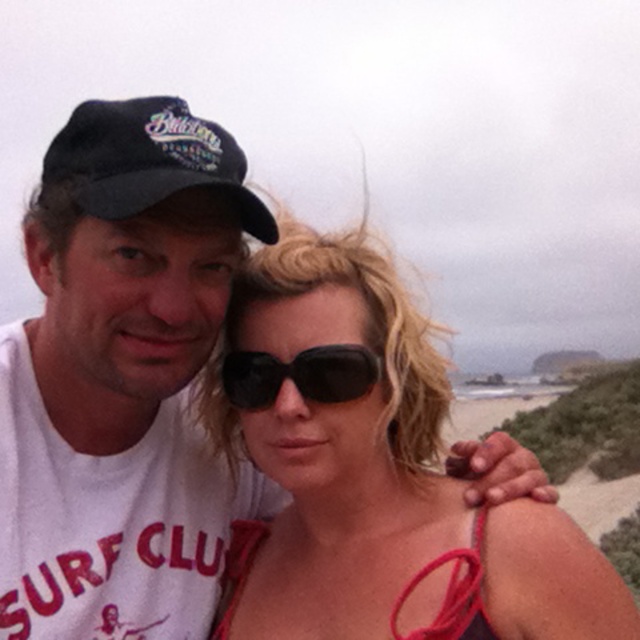
Question: Is matte black sunglasses at center smaller than black fabric baseball cap at upper left?

Choices:
 (A) yes
 (B) no

Answer: (A)

Question: Among these points, which one is nearest to the camera?

Choices:
 (A) (228, 380)
 (B) (240, 221)
 (C) (320, 323)

Answer: (B)

Question: Can you confirm if matte black sunglasses at center is positioned below black fabric baseball cap at upper left?

Choices:
 (A) no
 (B) yes

Answer: (B)

Question: Which point is farther from the camera taking this photo?

Choices:
 (A) (x=296, y=433)
 (B) (x=83, y=163)

Answer: (A)

Question: Which point appears closest to the camera in this image?

Choices:
 (A) (376, 532)
 (B) (349, 388)

Answer: (B)

Question: Is matte black sunglasses at center to the left of black fabric baseball cap at upper left from the viewer's perspective?

Choices:
 (A) no
 (B) yes

Answer: (A)